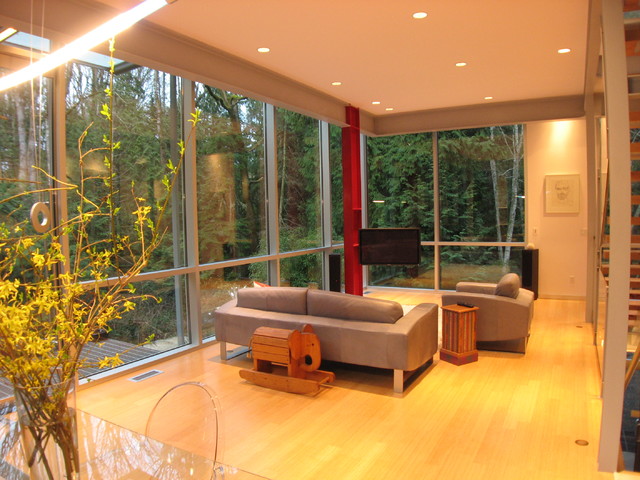
You are a GUI agent. You are given a task and a screenshot of the screen. Output one action in this format:
    pyautogui.click(x=<x>, y=<y>)
    Task: Click on the house plant
    Image resolution: width=640 pixels, height=480 pixels.
    Given the screenshot: What is the action you would take?
    pyautogui.click(x=59, y=368)